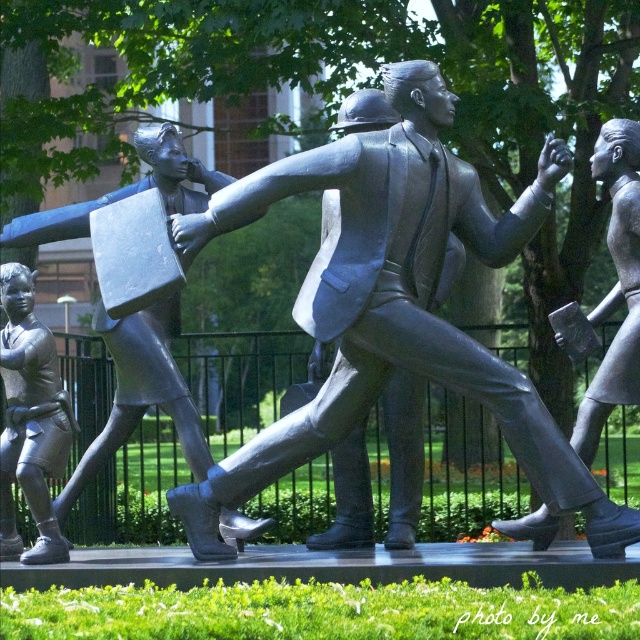
Question: Does polished bronze statue at center have a larger size compared to polished bronze statue at right?

Choices:
 (A) yes
 (B) no

Answer: (A)

Question: Which object is positioned closest to the brushed metal boy at lower left?

Choices:
 (A) bronze statue at left
 (B) polished bronze statue at right

Answer: (A)

Question: Can you confirm if polished bronze statue at center is bigger than brushed metal boy at lower left?

Choices:
 (A) yes
 (B) no

Answer: (A)

Question: Estimate the real-world distances between objects in this image. Which object is farther from the polished bronze statue at center?

Choices:
 (A) polished bronze statue at right
 (B) bronze statue at left
 (C) brushed metal boy at lower left

Answer: (C)

Question: Which point is closer to the camera taking this photo?

Choices:
 (A) (161, 371)
 (B) (52, 538)

Answer: (B)

Question: Is polished bronze statue at center above polished bronze statue at right?

Choices:
 (A) no
 (B) yes

Answer: (A)